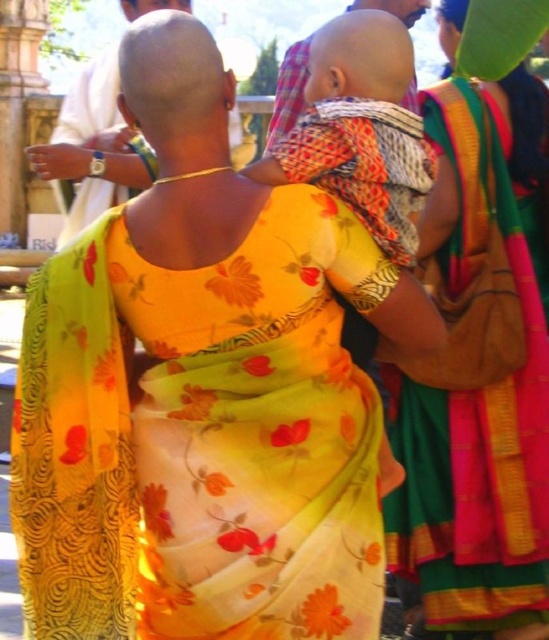
Does yellow floral sari at center have a smaller size compared to patterned fabric baby at center?

Yes, yellow floral sari at center is smaller than patterned fabric baby at center.

Does yellow floral sari at center have a lesser height compared to patterned fabric baby at center?

Correct, yellow floral sari at center is not as tall as patterned fabric baby at center.

Locate an element on the screen. yellow floral sari at center is located at coordinates (479, 371).

Can you confirm if yellow floral fabric dress at center is positioned below yellow floral sari at center?

Indeed, yellow floral fabric dress at center is positioned under yellow floral sari at center.

Does yellow floral fabric dress at center appear over yellow floral sari at center?

No.

Does point (154, 468) come in front of point (492, 278)?

Yes, point (154, 468) is in front of point (492, 278).

Find the location of a particular element. The image size is (549, 640). yellow floral fabric dress at center is located at coordinates (201, 438).

Is yellow floral fabric dress at center to the left of patterned fabric baby at center from the viewer's perspective?

Indeed, yellow floral fabric dress at center is positioned on the left side of patterned fabric baby at center.

Is yellow floral fabric dress at center taller than patterned fabric baby at center?

No, yellow floral fabric dress at center is not taller than patterned fabric baby at center.

Between point (74, 424) and point (355, 4), which one is positioned in front?

Point (74, 424)

At what (x,y) coordinates should I click in order to perform the action: click on yellow floral fabric dress at center. Please return your answer as a coordinate pair (x, y). The image size is (549, 640). Looking at the image, I should click on (201, 438).